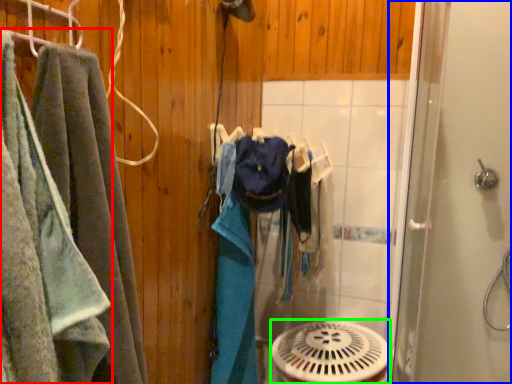
Question: Considering the real-world distances, which object is closest to towel (highlighted by a red box)? screen door (highlighted by a blue box) or mechanical fan (highlighted by a green box).

Choices:
 (A) screen door
 (B) mechanical fan

Answer: (B)